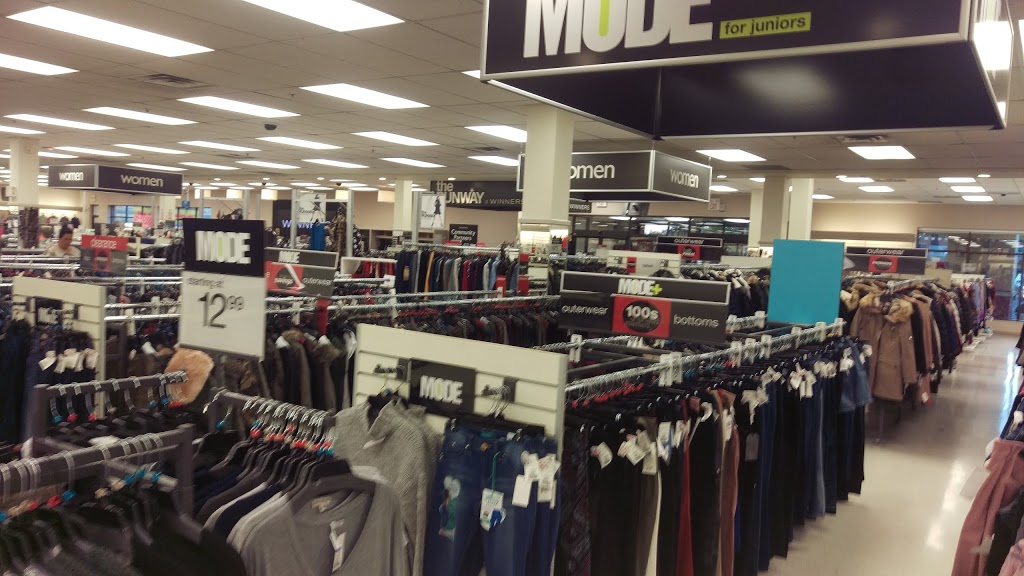
Where is `overhead rectangular lights`? The image size is (1024, 576). overhead rectangular lights is located at coordinates (377, 98).